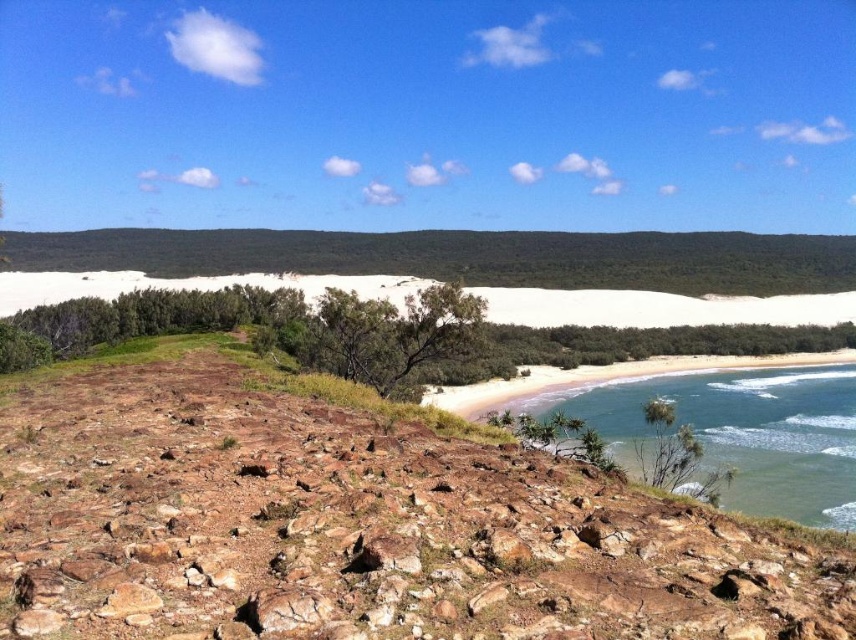
Does green grassy hillside at center have a greater width compared to smooth sand beach at lower right?

Indeed, green grassy hillside at center has a greater width compared to smooth sand beach at lower right.

Is point (586, 253) closer to viewer compared to point (467, 408)?

That is False.

Locate an element on the screen. green grassy hillside at center is located at coordinates (462, 257).

Is green grassy hillside at center positioned before blue-green water at lower right?

No, green grassy hillside at center is further to the viewer.

Does green grassy hillside at center appear under blue-green water at lower right?

Actually, green grassy hillside at center is above blue-green water at lower right.

Find the location of `green grassy hillside at center`. green grassy hillside at center is located at coordinates (462, 257).

Between point (798, 371) and point (480, 390), which one is positioned behind?

The point (798, 371) is more distant.

Which is in front, point (635, 396) or point (710, 368)?

Point (635, 396) is more forward.

Who is more forward, [795,470] or [813,358]?

Point [795,470] is more forward.

The width and height of the screenshot is (856, 640). In order to click on blue-green water at lower right in this screenshot , I will do pyautogui.click(x=739, y=433).